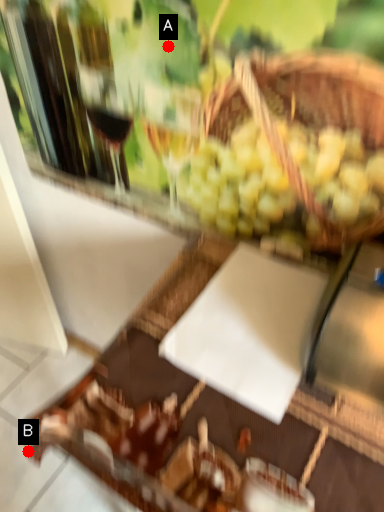
Question: Two points are circled on the image, labeled by A and B beside each circle. Among these points, which one is nearest to the camera?

Choices:
 (A) A is closer
 (B) B is closer

Answer: (B)